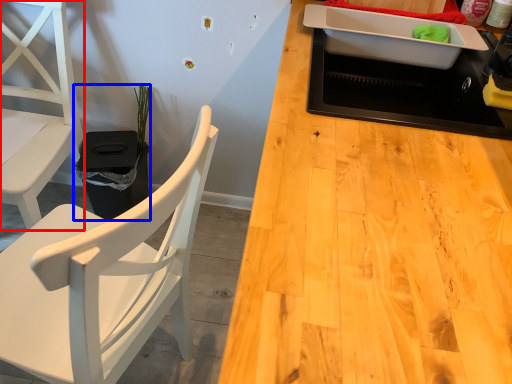
Question: Which of the following is the closest to the observer, chair (highlighted by a red box) or houseplant (highlighted by a blue box)?

Choices:
 (A) chair
 (B) houseplant

Answer: (A)